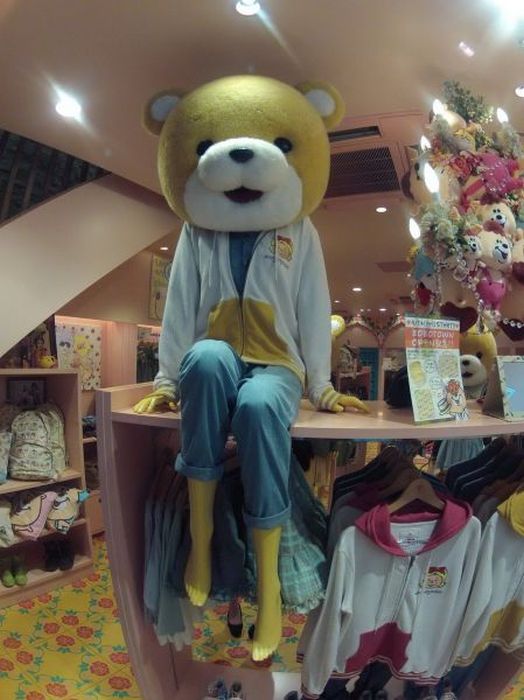
Locate an element on the screen. The width and height of the screenshot is (524, 700). stairs is located at coordinates (94, 267).